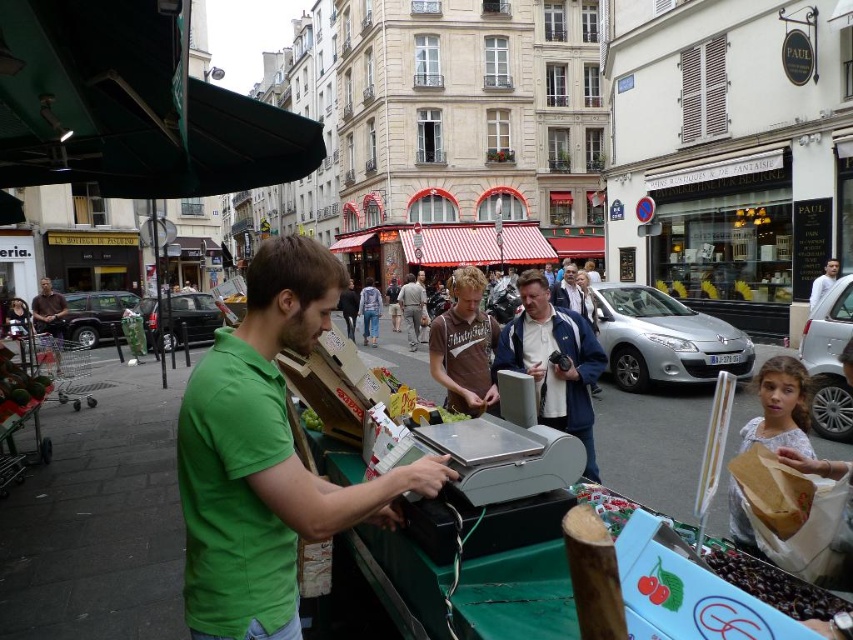
Question: Is green matte shirt at center further to camera compared to matte gray cash register at center?

Choices:
 (A) no
 (B) yes

Answer: (A)

Question: Which object appears closest to the camera in this image?

Choices:
 (A) green matte shirt at center
 (B) matte gray cash register at center
 (C) brown cotton shirt at center

Answer: (A)

Question: Does matte gray cash register at center have a greater width compared to brown cotton shirt at center?

Choices:
 (A) yes
 (B) no

Answer: (A)

Question: Does green matte shirt at center appear under brown cotton shirt at center?

Choices:
 (A) no
 (B) yes

Answer: (B)

Question: Which object appears farthest from the camera in this image?

Choices:
 (A) brown cotton shirt at center
 (B) green matte shirt at center
 (C) matte gray cash register at center

Answer: (A)

Question: Estimate the real-world distances between objects in this image. Which object is farther from the green matte shirt at center?

Choices:
 (A) matte gray cash register at center
 (B) brown cotton shirt at center

Answer: (B)